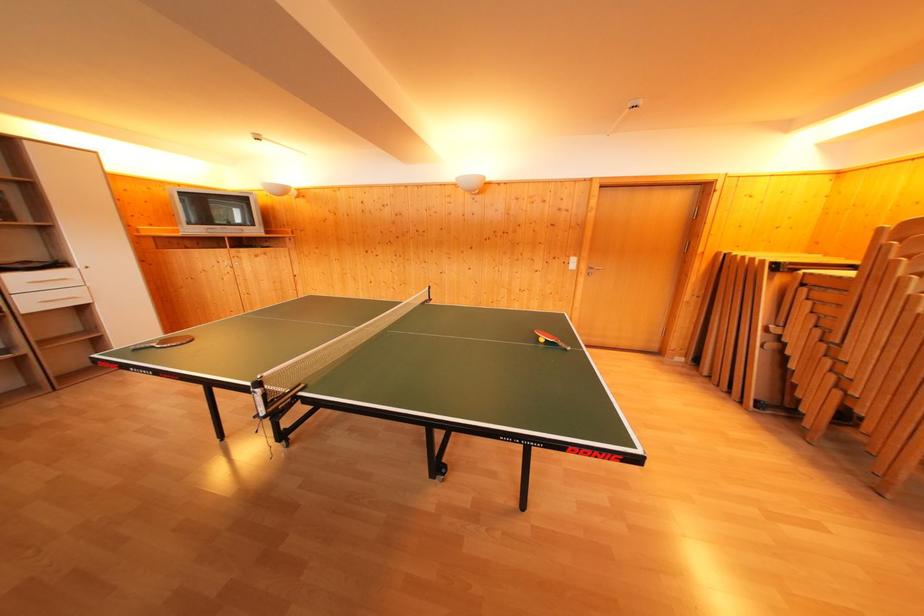
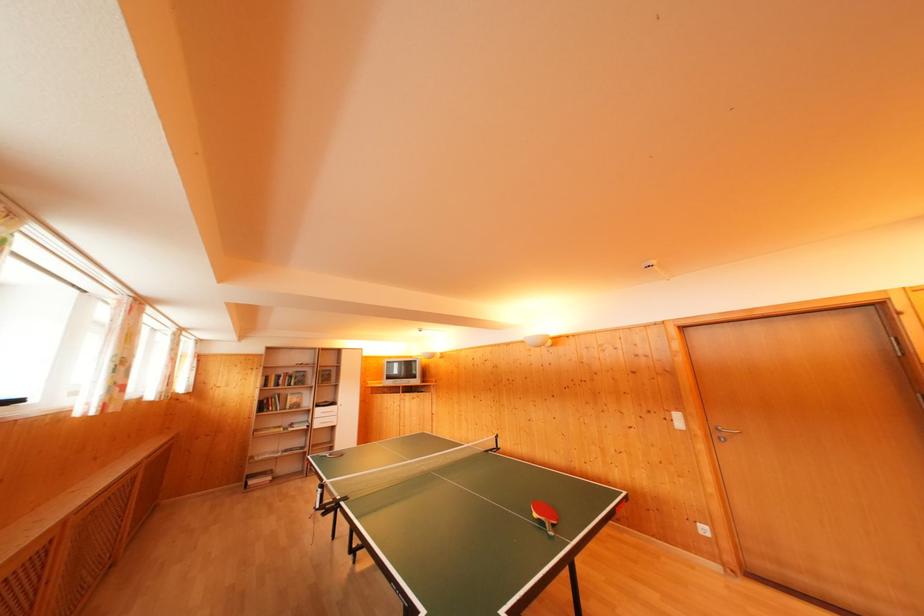
In the second image, find the point that corresponds to (x=546, y=345) in the first image.

(541, 521)